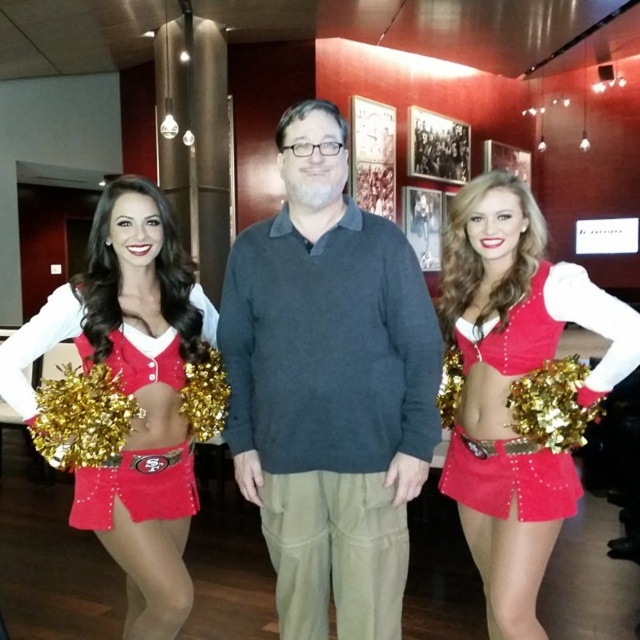
Is dark gray sweater at center to the right of matte red cheerleader outfit at right from the viewer's perspective?

Incorrect, dark gray sweater at center is not on the right side of matte red cheerleader outfit at right.

Does point (250, 369) come in front of point (522, 461)?

That is False.

This screenshot has width=640, height=640. What do you see at coordinates (330, 387) in the screenshot?
I see `dark gray sweater at center` at bounding box center [330, 387].

Where is `dark gray sweater at center`? The height and width of the screenshot is (640, 640). dark gray sweater at center is located at coordinates (330, 387).

Does dark gray sweater at center come in front of matte red cheerleader at center?

No, it is behind matte red cheerleader at center.

Which is behind, point (317, 312) or point (468, 209)?

The point (468, 209) is behind.

The image size is (640, 640). What are the coordinates of `dark gray sweater at center` in the screenshot? It's located at (330, 387).

Is matte red cheerleader outfit at right above red velvet cheerleader outfit at left?

Correct, matte red cheerleader outfit at right is located above red velvet cheerleader outfit at left.

Is matte red cheerleader outfit at right taller than red velvet cheerleader outfit at left?

Indeed, matte red cheerleader outfit at right has a greater height compared to red velvet cheerleader outfit at left.

Measure the distance between point (579, 493) and camera.

They are 5.80 feet apart.

Image resolution: width=640 pixels, height=640 pixels. Identify the location of matte red cheerleader outfit at right. (509, 480).